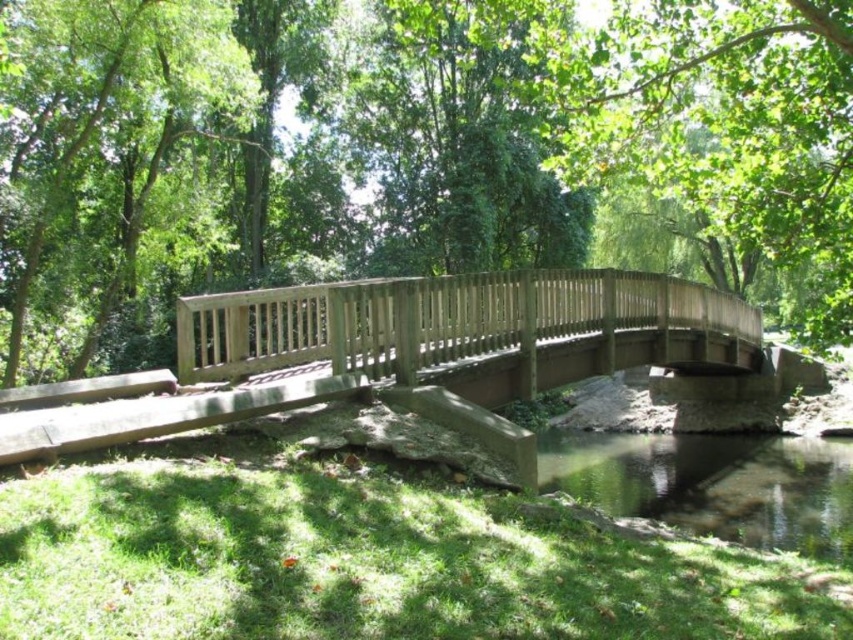
Is point (144, 278) positioned behind point (276, 355)?

Yes, it is behind point (276, 355).

Does green leafy tree at center appear over wooden bridge at center?

Indeed, green leafy tree at center is positioned over wooden bridge at center.

At what (x,y) coordinates should I click in order to perform the action: click on green leafy tree at center. Please return your answer as a coordinate pair (x, y). This screenshot has height=640, width=853. Looking at the image, I should click on (108, 164).

Does point (126, 61) come behind point (381, 324)?

Yes.

Describe the element at coordinates (410, 154) in the screenshot. Image resolution: width=853 pixels, height=640 pixels. I see `green matte bridge at center` at that location.

Locate an element on the screen. This screenshot has height=640, width=853. green matte bridge at center is located at coordinates (410, 154).

Who is higher up, green leafy tree at center or clear water at lower center?

green leafy tree at center is higher up.

Looking at this image, is green leafy tree at center below clear water at lower center?

Actually, green leafy tree at center is above clear water at lower center.

Does point (187, 13) come closer to viewer compared to point (695, 464)?

Yes, point (187, 13) is in front of point (695, 464).

I want to click on green leafy tree at center, so click(x=108, y=164).